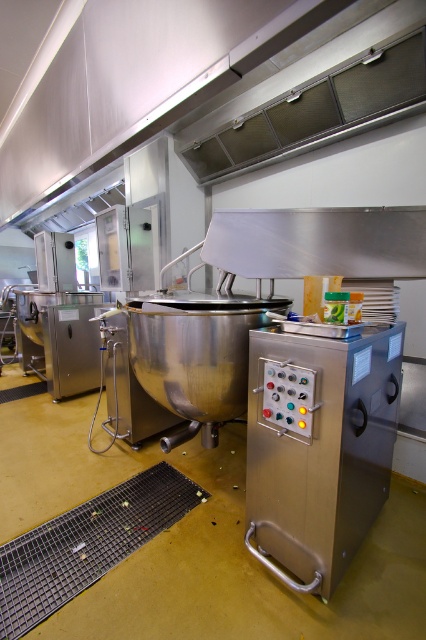
Question: Which object is the closest to the stainless steel control panel at center?

Choices:
 (A) polished stainless steel mixer at center
 (B) brushed metal/steel industrial mixer at left
 (C) satin silver exhaust hood at upper center

Answer: (A)

Question: Which of the following is the farthest from the observer?

Choices:
 (A) brushed metal/steel industrial mixer at left
 (B) satin silver cabinet at center

Answer: (A)

Question: Is the position of stainless steel control panel at center more distant than that of satin silver exhaust hood at upper center?

Choices:
 (A) yes
 (B) no

Answer: (B)

Question: Which object is positioned closest to the brushed metal/steel industrial mixer at left?

Choices:
 (A) satin silver cabinet at center
 (B) stainless steel control panel at center

Answer: (A)

Question: Is stainless steel control panel at center below brushed metal/steel industrial mixer at left?

Choices:
 (A) yes
 (B) no

Answer: (A)

Question: Can you confirm if polished stainless steel mixer at center is positioned to the left of brushed metal/steel industrial mixer at left?

Choices:
 (A) yes
 (B) no

Answer: (B)